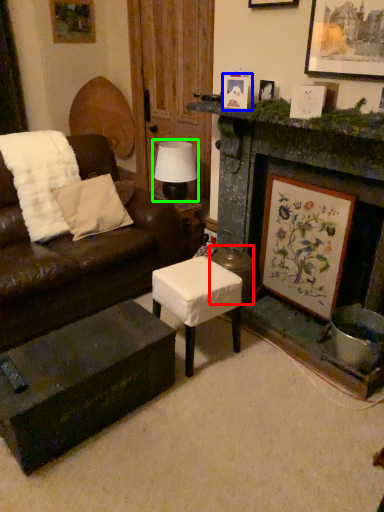
Question: Estimate the real-world distances between objects in this image. Which object is closer to stool (highlighted by a red box), picture frame (highlighted by a blue box) or table lamp (highlighted by a green box)?

Choices:
 (A) picture frame
 (B) table lamp

Answer: (B)